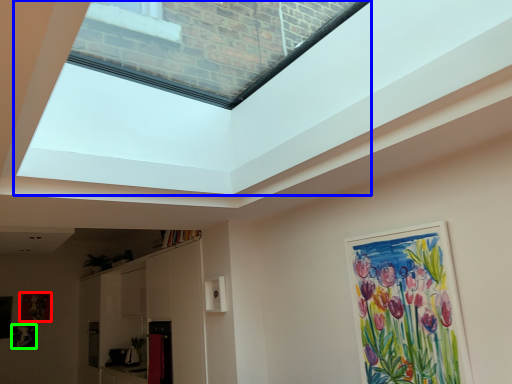
Question: Which is nearer to the picture frame (highlighted by a red box)? window screen (highlighted by a blue box) or picture frame (highlighted by a green box).

Choices:
 (A) window screen
 (B) picture frame

Answer: (B)